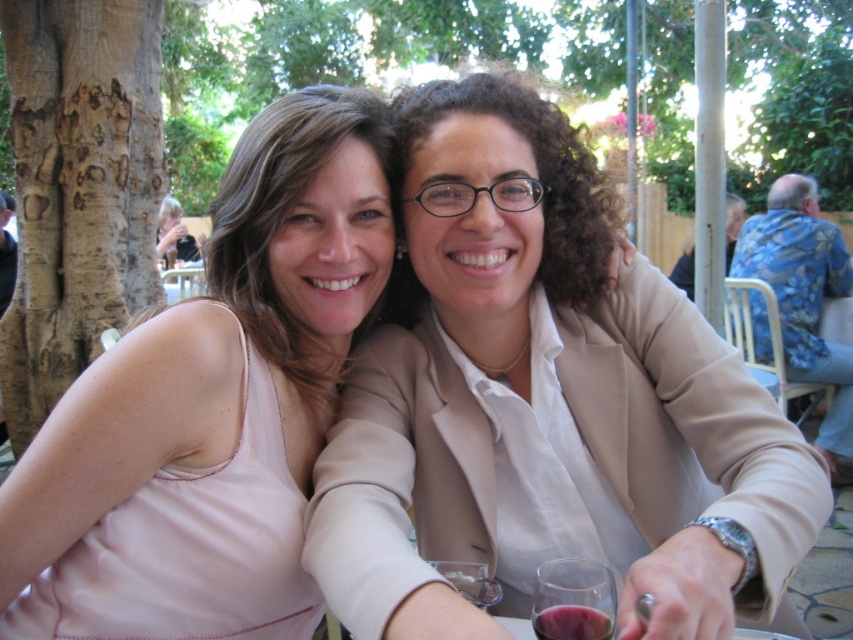
Can you confirm if pink fabric tank top at upper left is positioned below translucent glass at lower center?

No, pink fabric tank top at upper left is not below translucent glass at lower center.

Identify the location of pink fabric tank top at upper left. (222, 333).

Can you confirm if translucent glass at lower center is shorter than transparent plastic wine glass at lower center?

Yes.

Is point (606, 611) positioned in front of point (450, 579)?

Yes, point (606, 611) is closer to viewer.

Which is behind, point (578, 602) or point (468, 589)?

The point (468, 589) is more distant.

I want to click on translucent glass at lower center, so click(573, 600).

Looking at this image, who is positioned more to the right, matte beige blazer at center or transparent plastic wine glass at lower center?

matte beige blazer at center is more to the right.

Based on the photo, can you confirm if matte beige blazer at center is smaller than transparent plastic wine glass at lower center?

No.

Describe the element at coordinates (547, 403) in the screenshot. This screenshot has width=853, height=640. I see `matte beige blazer at center` at that location.

Find the location of a particular element. This screenshot has height=640, width=853. matte beige blazer at center is located at coordinates (547, 403).